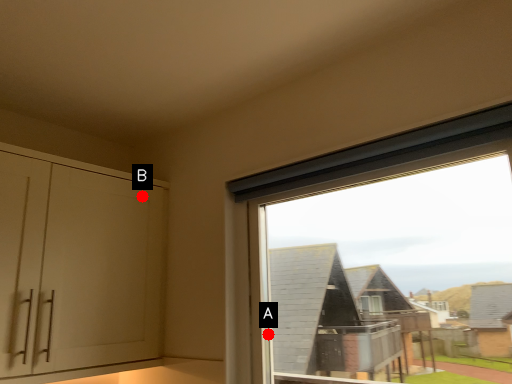
Question: Two points are circled on the image, labeled by A and B beside each circle. Among these points, which one is nearest to the camera?

Choices:
 (A) A is closer
 (B) B is closer

Answer: (A)